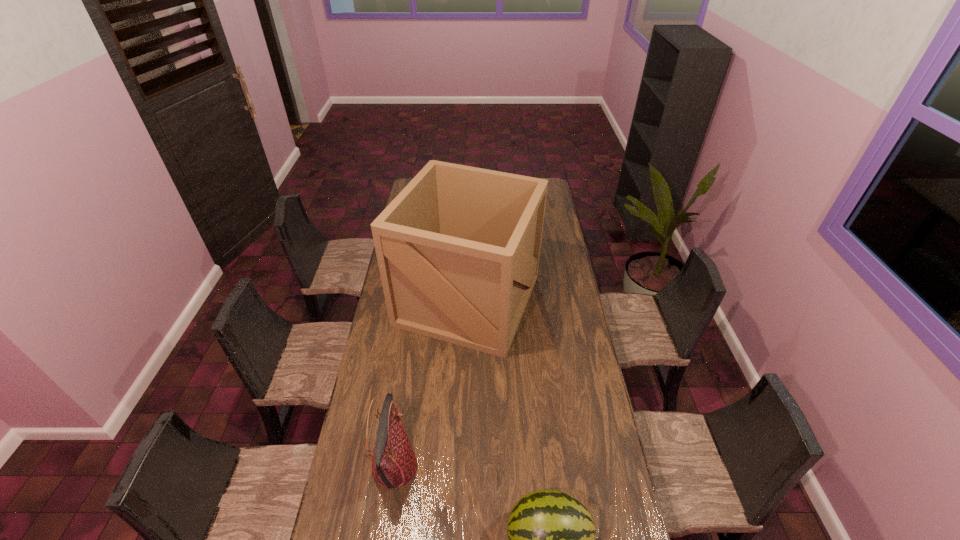
Find the location of a particular element. This screenshot has height=540, width=960. vacant point located between the second nearest object and the farthest object is located at coordinates (431, 383).

Choose which object is the second nearest neighbor to the nearest object. Please provide its 2D coordinates. Your answer should be formatted as a tuple, i.e. [(x, y)], where the tuple contains the x and y coordinates of a point satisfying the conditions above.

[(458, 249)]

This screenshot has height=540, width=960. I want to click on object that is the closest to the farthest object, so click(x=394, y=464).